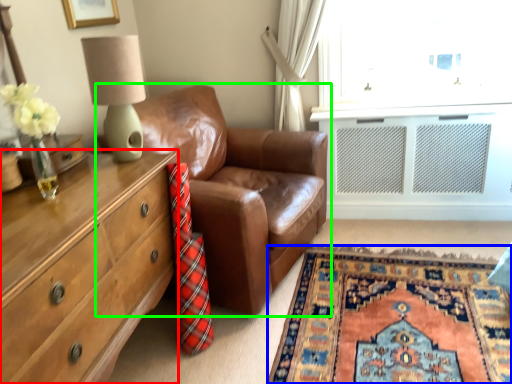
Question: Based on their relative distances, which object is nearer to chest of drawers (highlighted by a red box)? Choose from plain (highlighted by a blue box) and studio couch (highlighted by a green box).

Choices:
 (A) plain
 (B) studio couch

Answer: (B)